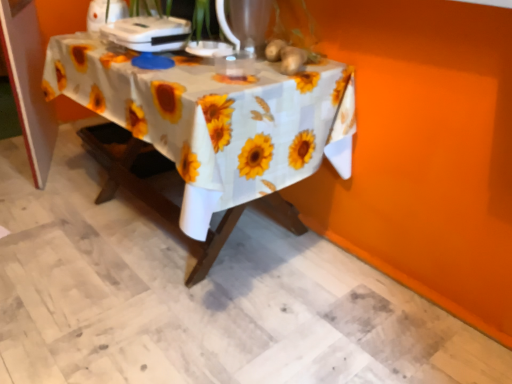
Describe the element at coordinates (292, 59) in the screenshot. I see `yellow matte sunflower at upper center, the 1th flower from the front` at that location.

Locate an element on the screen. white plastic appliance at upper center, arranged as the second appliance when viewed from the left is located at coordinates (148, 33).

What is the approximate height of yellow matte sunflower at upper center, the 2th flower from the front?

The height of yellow matte sunflower at upper center, the 2th flower from the front, is 1.96 inches.

Where is `yellow matte sunflower at upper center, the 2th flower from the front`? yellow matte sunflower at upper center, the 2th flower from the front is located at coordinates (275, 50).

The image size is (512, 384). What do you see at coordinates (210, 130) in the screenshot?
I see `white fabric tablecloth at center` at bounding box center [210, 130].

Where is `white plastic appliance at upper center, which is counted as the 2th appliance, starting from the right`? The width and height of the screenshot is (512, 384). white plastic appliance at upper center, which is counted as the 2th appliance, starting from the right is located at coordinates (105, 13).

Is yellow matte sunflower at upper center, the 2th flower from the front, touching yellow matte sunflower at upper center, the 1th flower from the front?

Yes, yellow matte sunflower at upper center, the 2th flower from the front, is with yellow matte sunflower at upper center, the 1th flower from the front.

Looking at the image, does yellow matte sunflower at upper center, the 2th flower from the front, seem bigger or smaller compared to yellow matte sunflower at upper center, the 1th flower from the front?

Clearly, yellow matte sunflower at upper center, the 2th flower from the front, is smaller in size than yellow matte sunflower at upper center, the 1th flower from the front.

Is yellow matte sunflower at upper center, the first flower from the back, oriented towards yellow matte sunflower at upper center, the 1th flower from the front?

No, yellow matte sunflower at upper center, the first flower from the back, is not aimed at yellow matte sunflower at upper center, the 1th flower from the front.

In the scene shown: Can you tell me how much yellow matte sunflower at upper center, the 2th flower from the front, and yellow matte sunflower at upper center, the second flower viewed from the back, differ in facing direction?

7.16 degrees.

Is white plastic appliance at upper center, which is counted as the 2th appliance, starting from the right, positioned far away from yellow matte sunflower at upper center, the 1th flower from the front?

No, white plastic appliance at upper center, which is counted as the 2th appliance, starting from the right, is not far from yellow matte sunflower at upper center, the 1th flower from the front.

Is the depth of white plastic appliance at upper center, which is counted as the 2th appliance, starting from the right, less than that of yellow matte sunflower at upper center, the 1th flower from the front?

No, white plastic appliance at upper center, which is counted as the 2th appliance, starting from the right, is further to the viewer.

Is point (93, 21) in front of point (298, 57)?

No.

Would you say yellow matte sunflower at upper center, the second flower viewed from the back, is a long distance from white plastic appliance at upper center, placed as the 1th appliance when sorted from right to left?

No, yellow matte sunflower at upper center, the second flower viewed from the back, is not far from white plastic appliance at upper center, placed as the 1th appliance when sorted from right to left.

Considering the sizes of objects yellow matte sunflower at upper center, the 1th flower from the front, and white plastic appliance at upper center, arranged as the second appliance when viewed from the left, in the image provided, who is shorter, yellow matte sunflower at upper center, the 1th flower from the front, or white plastic appliance at upper center, arranged as the second appliance when viewed from the left,?

Standing shorter between the two is yellow matte sunflower at upper center, the 1th flower from the front.

Is yellow matte sunflower at upper center, the second flower viewed from the back, inside the boundaries of white plastic appliance at upper center, placed as the 1th appliance when sorted from right to left, or outside?

yellow matte sunflower at upper center, the second flower viewed from the back, cannot be found inside white plastic appliance at upper center, placed as the 1th appliance when sorted from right to left.

From a real-world perspective, between yellow matte sunflower at upper center, the 2th flower from the front, and white plastic appliance at upper center, placed as the 1th appliance when sorted from right to left, who is vertically lower?

yellow matte sunflower at upper center, the 2th flower from the front, is physically lower.

From the image's perspective, between yellow matte sunflower at upper center, the first flower from the back, and white plastic appliance at upper center, placed as the 1th appliance when sorted from right to left, who is located below?

From the image's view, yellow matte sunflower at upper center, the first flower from the back, is below.

From the picture: Between yellow matte sunflower at upper center, the first flower from the back, and white plastic appliance at upper center, arranged as the second appliance when viewed from the left, which one appears on the left side from the viewer's perspective?

From the viewer's perspective, white plastic appliance at upper center, arranged as the second appliance when viewed from the left, appears more on the left side.

Which of these two, yellow matte sunflower at upper center, the 2th flower from the front, or white plastic appliance at upper center, which is the 1th appliance in left-to-right order, is thinner?

With smaller width is yellow matte sunflower at upper center, the 2th flower from the front.

From a real-world perspective, which is physically below, yellow matte sunflower at upper center, the 2th flower from the front, or white plastic appliance at upper center, which is counted as the 2th appliance, starting from the right?

yellow matte sunflower at upper center, the 2th flower from the front, is physically lower.

From the image's perspective, which is above, white fabric tablecloth at center or white plastic appliance at upper center, arranged as the second appliance when viewed from the left?

white plastic appliance at upper center, arranged as the second appliance when viewed from the left, is shown above in the image.

There is a white fabric tablecloth at center. Where is `the 1st appliance above it (from the image's perspective)`? the 1st appliance above it (from the image's perspective) is located at coordinates (148, 33).

Consider the image. Is the position of white fabric tablecloth at center more distant than that of white plastic appliance at upper center, arranged as the second appliance when viewed from the left?

No.

Considering the sizes of white fabric tablecloth at center and white plastic appliance at upper center, placed as the 1th appliance when sorted from right to left, in the image, is white fabric tablecloth at center wider or thinner than white plastic appliance at upper center, placed as the 1th appliance when sorted from right to left,?

Clearly, white fabric tablecloth at center has more width compared to white plastic appliance at upper center, placed as the 1th appliance when sorted from right to left.

Is white plastic appliance at upper center, which is the 1th appliance in left-to-right order, inside or outside of white fabric tablecloth at center?

white plastic appliance at upper center, which is the 1th appliance in left-to-right order, is not inside white fabric tablecloth at center, it's outside.

Locate an element on the screen. table to the right of white plastic appliance at upper center, which is the 1th appliance in left-to-right order is located at coordinates (210, 130).

From the image's perspective, between white plastic appliance at upper center, which is the 1th appliance in left-to-right order, and white fabric tablecloth at center, which one is located above?

white plastic appliance at upper center, which is the 1th appliance in left-to-right order, from the image's perspective.

Locate an element on the screen. The height and width of the screenshot is (384, 512). flower above the yellow matte sunflower at upper center, the 1th flower from the front (from the image's perspective) is located at coordinates (275, 50).

Which flower is the 2nd one when counting from the front of the white plastic appliance at upper center, which is the 1th appliance in left-to-right order? Please provide its 2D coordinates.

[(292, 59)]

When comparing their distances from white plastic appliance at upper center, placed as the 1th appliance when sorted from right to left, does yellow matte sunflower at upper center, the 1th flower from the front, or white fabric tablecloth at center seem closer?

The object closer to white plastic appliance at upper center, placed as the 1th appliance when sorted from right to left, is white fabric tablecloth at center.

Looking at the image, which one is located further to white plastic appliance at upper center, arranged as the second appliance when viewed from the left, yellow matte sunflower at upper center, the 1th flower from the front, or yellow matte sunflower at upper center, the first flower from the back?

yellow matte sunflower at upper center, the 1th flower from the front, lies further to white plastic appliance at upper center, arranged as the second appliance when viewed from the left, than the other object.

From the image, which object appears to be farther from yellow matte sunflower at upper center, the second flower viewed from the back, yellow matte sunflower at upper center, the 2th flower from the front, or white plastic appliance at upper center, arranged as the second appliance when viewed from the left?

Among the two, white plastic appliance at upper center, arranged as the second appliance when viewed from the left, is located further to yellow matte sunflower at upper center, the second flower viewed from the back.

Estimate the real-world distances between objects in this image. Which object is closer to white plastic appliance at upper center, which is the 1th appliance in left-to-right order, white plastic appliance at upper center, arranged as the second appliance when viewed from the left, or yellow matte sunflower at upper center, the 1th flower from the front?

white plastic appliance at upper center, arranged as the second appliance when viewed from the left, lies closer to white plastic appliance at upper center, which is the 1th appliance in left-to-right order, than the other object.

Based on their spatial positions, is yellow matte sunflower at upper center, the 2th flower from the front, or yellow matte sunflower at upper center, the 1th flower from the front, closer to white plastic appliance at upper center, which is the 1th appliance in left-to-right order?

yellow matte sunflower at upper center, the 2th flower from the front, lies closer to white plastic appliance at upper center, which is the 1th appliance in left-to-right order, than the other object.

Based on their spatial positions, is white plastic appliance at upper center, which is counted as the 2th appliance, starting from the right, or yellow matte sunflower at upper center, the 2th flower from the front, closer to yellow matte sunflower at upper center, the second flower viewed from the back?

Based on the image, yellow matte sunflower at upper center, the 2th flower from the front, appears to be nearer to yellow matte sunflower at upper center, the second flower viewed from the back.

Looking at this image, based on their spatial positions, is yellow matte sunflower at upper center, the second flower viewed from the back, or white plastic appliance at upper center, placed as the 1th appliance when sorted from right to left, closer to white fabric tablecloth at center?

The object closer to white fabric tablecloth at center is white plastic appliance at upper center, placed as the 1th appliance when sorted from right to left.

Which object lies nearer to the anchor point white plastic appliance at upper center, which is the 1th appliance in left-to-right order, white fabric tablecloth at center or yellow matte sunflower at upper center, the second flower viewed from the back?

The object closer to white plastic appliance at upper center, which is the 1th appliance in left-to-right order, is white fabric tablecloth at center.

The image size is (512, 384). I want to click on table between white plastic appliance at upper center, placed as the 1th appliance when sorted from right to left, and yellow matte sunflower at upper center, the first flower from the back, so click(x=210, y=130).

At what (x,y) coordinates should I click in order to perform the action: click on appliance between white plastic appliance at upper center, which is counted as the 2th appliance, starting from the right, and yellow matte sunflower at upper center, the second flower viewed from the back, in the horizontal direction. Please return your answer as a coordinate pair (x, y). The image size is (512, 384). Looking at the image, I should click on (148, 33).

Identify the location of table situated between white plastic appliance at upper center, placed as the 1th appliance when sorted from right to left, and yellow matte sunflower at upper center, the 1th flower from the front, from left to right. (210, 130).

Identify the location of flower between white fabric tablecloth at center and yellow matte sunflower at upper center, the 1th flower from the front, from left to right. (275, 50).